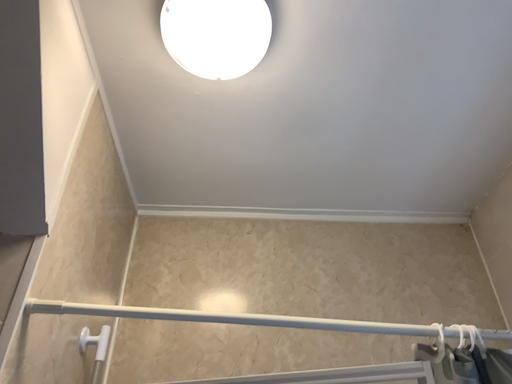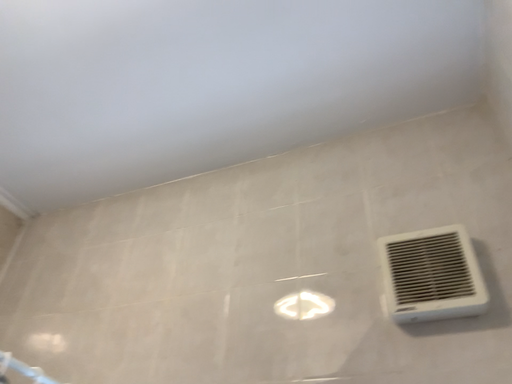
Question: Which way did the camera rotate in the video?

Choices:
 (A) rotated upward
 (B) rotated downward

Answer: (B)